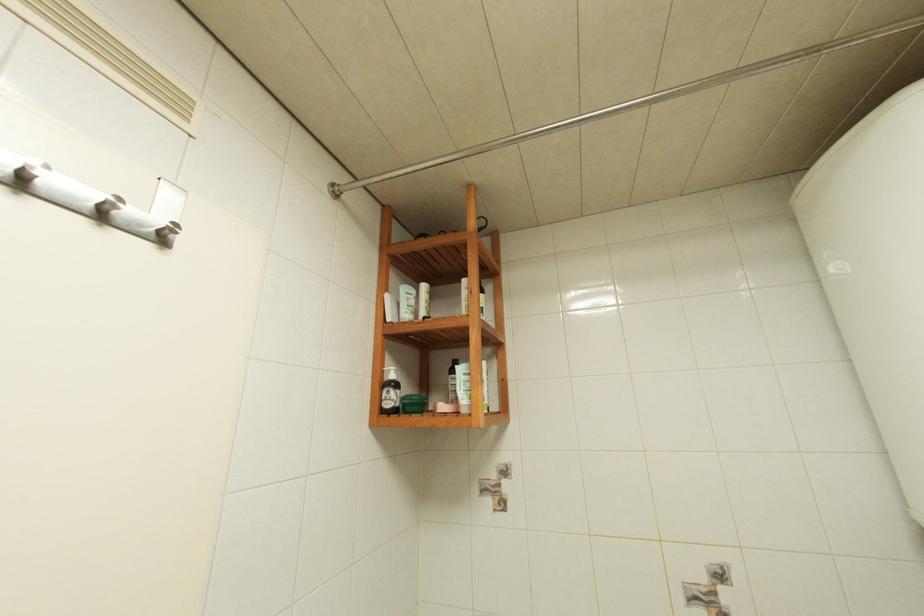
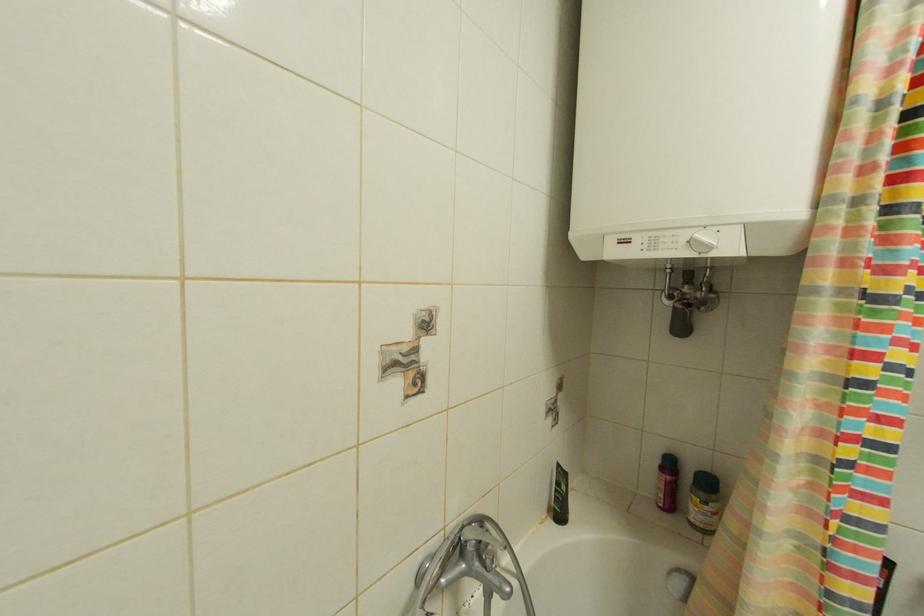
Question: The camera is either moving clockwise (left) or counter-clockwise (right) around the object. The first image is from the beginning of the video and the second image is from the end. Is the camera moving left or right when shooting the video?

Choices:
 (A) Left
 (B) Right

Answer: (A)